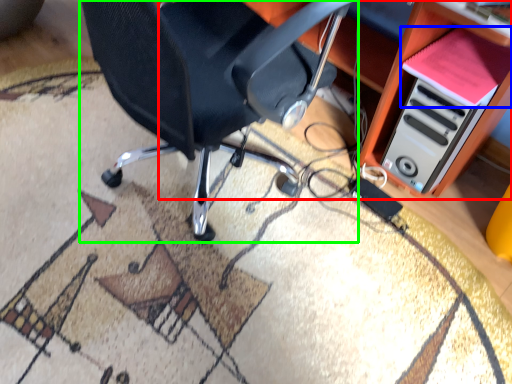
Question: Based on their relative distances, which object is nearer to computer desk (highlighted by a red box)? Choose from book (highlighted by a blue box) and chair (highlighted by a green box).

Choices:
 (A) book
 (B) chair

Answer: (A)